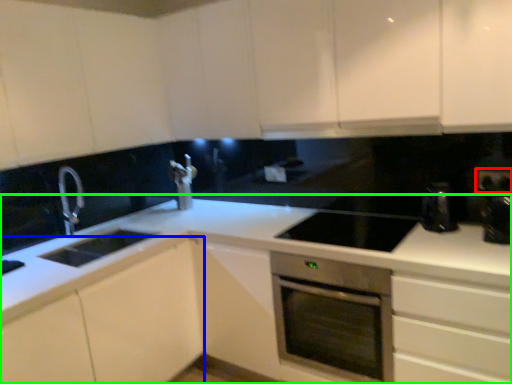
Question: Which object is positioned closest to electric outlet (highlighted by a red box)? Select from cabinetry (highlighted by a blue box) and countertop (highlighted by a green box).

Choices:
 (A) cabinetry
 (B) countertop

Answer: (B)